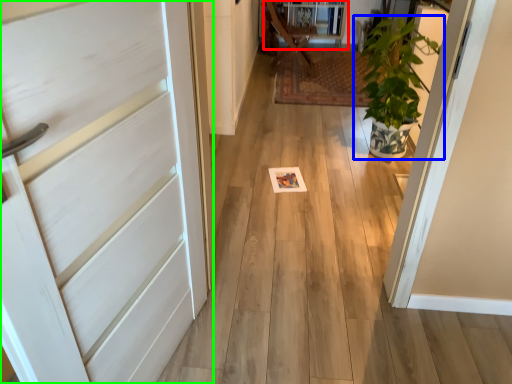
Question: Based on their relative distances, which object is nearer to bookshelf (highlighted by a red box)? Choose from houseplant (highlighted by a blue box) and door (highlighted by a green box).

Choices:
 (A) houseplant
 (B) door

Answer: (A)